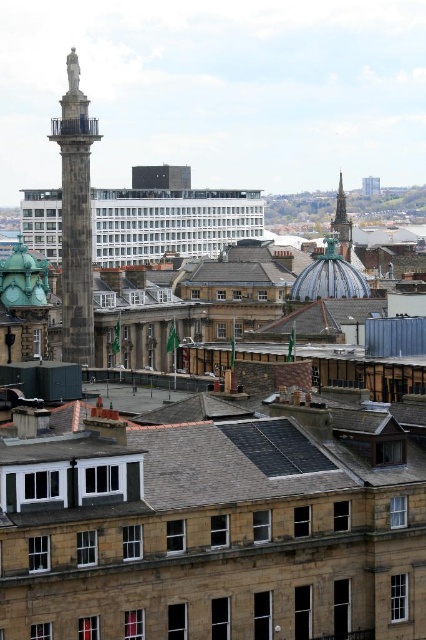
Identify the location of dark gray slate roof at center. Image resolution: width=426 pixels, height=640 pixels. (189, 467).

Is dark gray slate roof at center smaller than dark gray stone column at upper left?

Yes, dark gray slate roof at center is smaller than dark gray stone column at upper left.

At what (x,y) coordinates should I click in order to perform the action: click on dark gray slate roof at center. Please return your answer as a coordinate pair (x, y). Looking at the image, I should click on (189, 467).